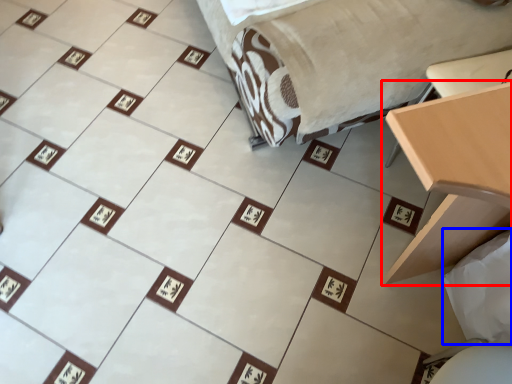
Question: Which object appears closest to the camera in this image, table (highlighted by a red box) or sheet (highlighted by a blue box)?

Choices:
 (A) table
 (B) sheet

Answer: (A)